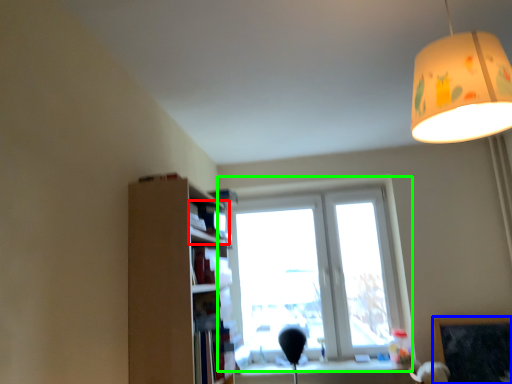
Question: Estimate the real-world distances between objects in this image. Which object is closer to book (highlighted by a red box), bulletin board (highlighted by a blue box) or window (highlighted by a green box)?

Choices:
 (A) bulletin board
 (B) window

Answer: (B)